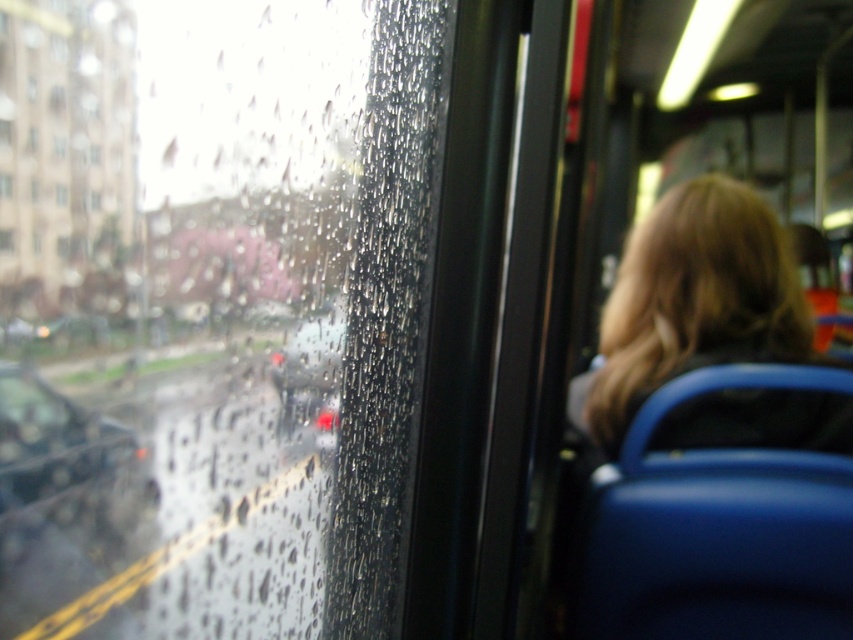
I want to click on metallic gray car at left, so click(68, 467).

Is metallic gray car at left positioned in front of transparent glass window at left?

Yes, metallic gray car at left is closer to the viewer.

Is point (32, 381) closer to viewer compared to point (64, 196)?

Yes.

You are a GUI agent. You are given a task and a screenshot of the screen. Output one action in this format:
    pyautogui.click(x=<x>, y=<y>)
    Task: Click on the metallic gray car at left
    
    Given the screenshot: What is the action you would take?
    pyautogui.click(x=68, y=467)

Does blonde hair at right have a larger size compared to shiny black car at center?

Yes, blonde hair at right is bigger than shiny black car at center.

Which is in front, point (747, 264) or point (312, 380)?

Point (312, 380) is more forward.

This screenshot has width=853, height=640. I want to click on blonde hair at right, so click(695, 300).

Identify the location of metallic gray car at left. (68, 467).

What are the coordinates of `metallic gray car at left` in the screenshot? It's located at (68, 467).